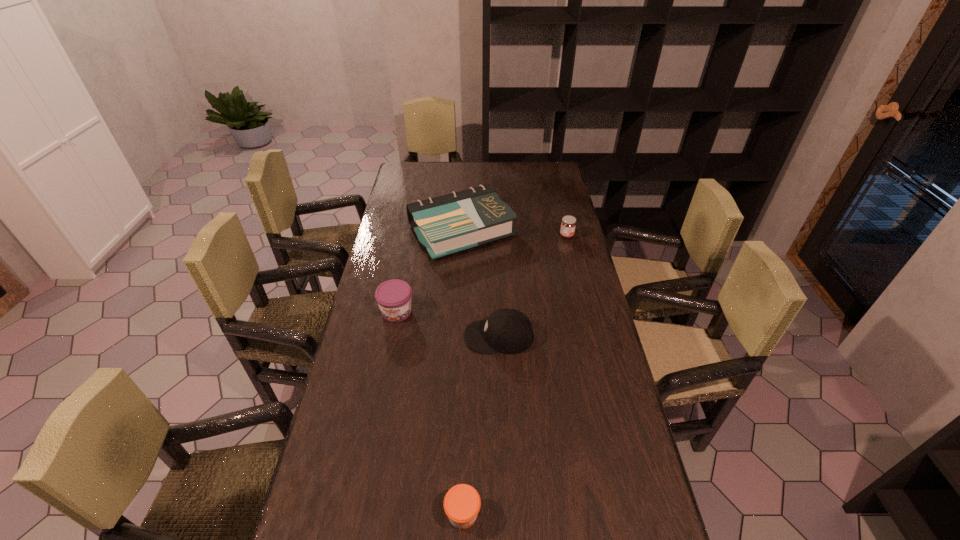
Select which jam is the closest to the leftmost jam. Please provide its 2D coordinates. Your answer should be formatted as a tuple, i.e. [(x, y)], where the tuple contains the x and y coordinates of a point satisfying the conditions above.

[(462, 503)]